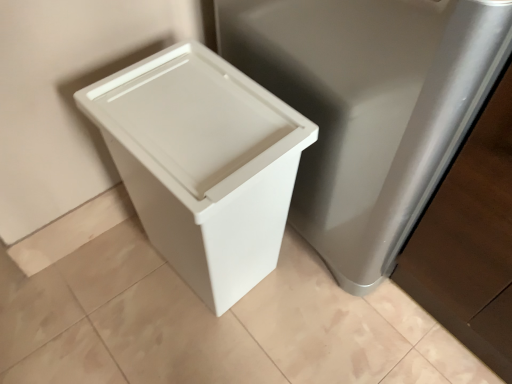
I want to click on free space to the left of white plastic waste container at left, so click(x=102, y=288).